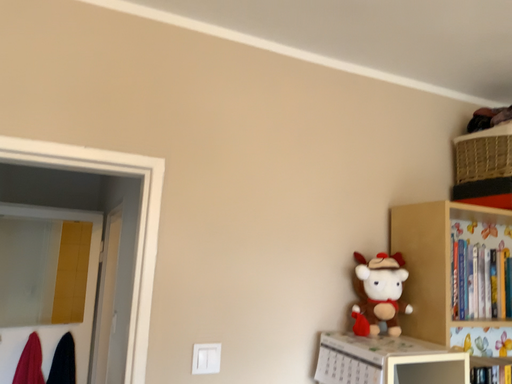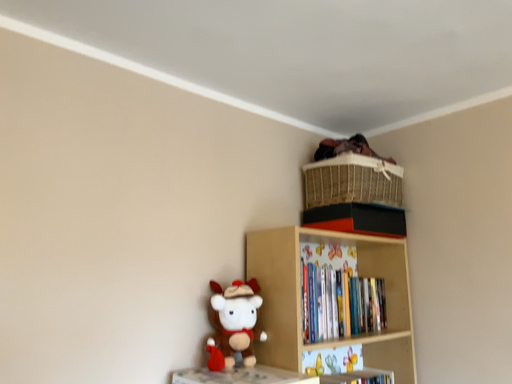
Question: How did the camera likely rotate when shooting the video?

Choices:
 (A) rotated left
 (B) rotated right

Answer: (B)